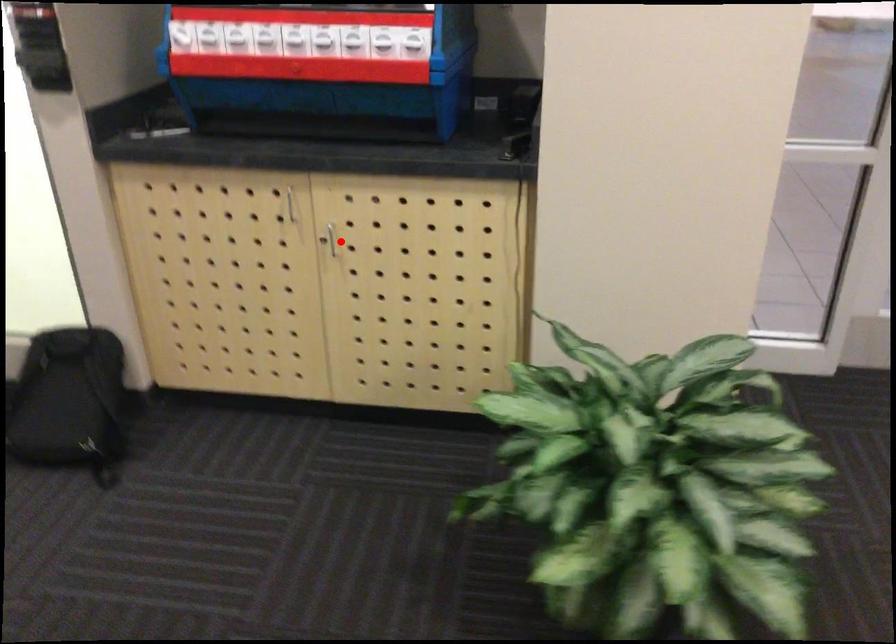
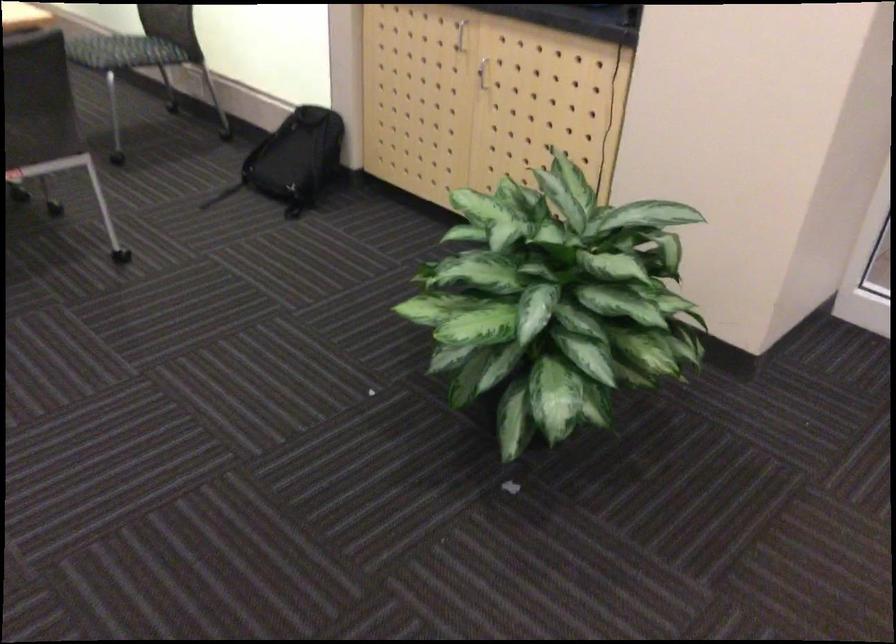
The point at the highlighted location is marked in the first image. Where is the corresponding point in the second image?

(483, 73)